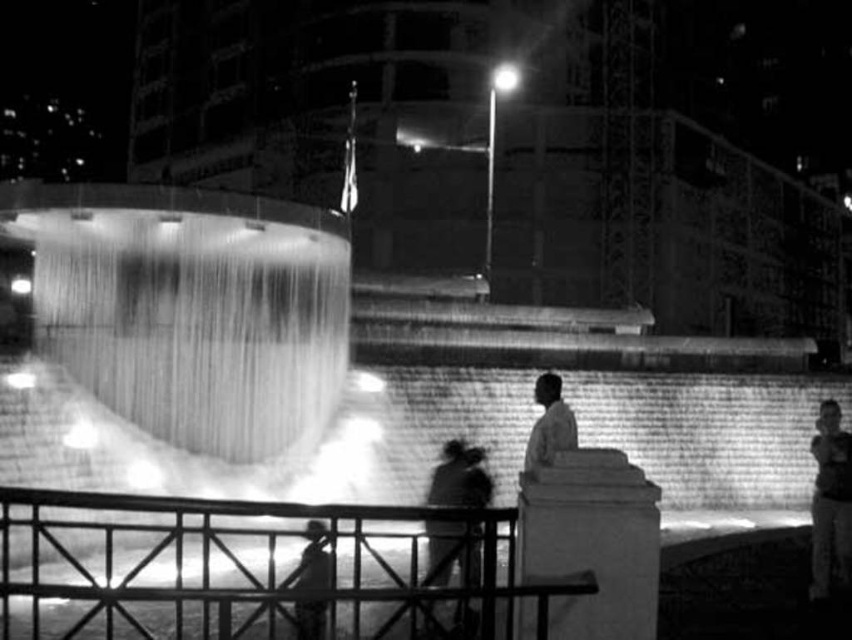
You are standing at the railing near the fountain and notice a silhouette fabric at lower center and a smooth skin face at right. Which object is closer to you?

The smooth skin face at right is closer to you because the silhouette fabric at lower center is behind it.

You are standing at the edge of the fountain and want to take a photo of the translucent glass water at center and the smooth skin face at right. Based on their sizes in the scene, which object should you zoom in on to capture both in the frame without moving your camera?

The translucent glass water at center is wider than the smooth skin face at right, so you should zoom in on the translucent glass water at center to include both objects in the frame.

You are standing at the center of the railing and want to walk towards the fountain. There are two points marked on the ground in front of you. The first point is at coordinates point [225,419] and the second point is at point [330,566]. Which point is closer to you as you face the fountain?

Point [225,419] is behind point [330,566], so the closer point to you as you face the fountain would be point [330,566].